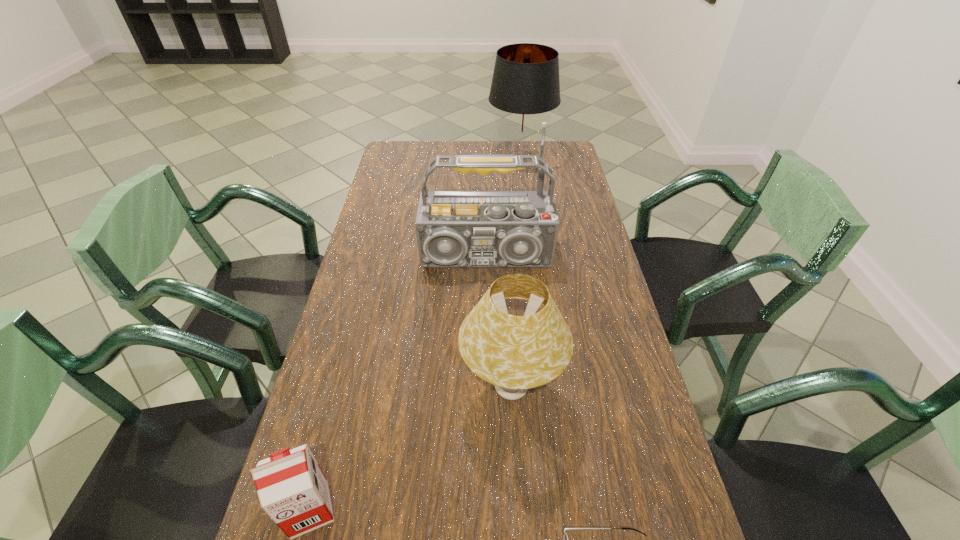
Where is `vacant region located on the back of the second shortest object`? Image resolution: width=960 pixels, height=540 pixels. vacant region located on the back of the second shortest object is located at coordinates (330, 430).

At what (x,y) coordinates should I click in order to perform the action: click on object positioned at the far edge. Please return your answer as a coordinate pair (x, y). The width and height of the screenshot is (960, 540). Looking at the image, I should click on (525, 86).

Where is `object located at the left edge`? object located at the left edge is located at coordinates (292, 489).

In order to click on object present at the right edge in this screenshot , I will do `click(525, 86)`.

The width and height of the screenshot is (960, 540). Find the location of `object at the far right corner`. object at the far right corner is located at coordinates (525, 86).

You are a GUI agent. You are given a task and a screenshot of the screen. Output one action in this format:
    pyautogui.click(x=<x>, y=<y>)
    Task: Click on the free region at the left edge of the desktop
    The image size is (960, 540).
    Given the screenshot: What is the action you would take?
    pyautogui.click(x=372, y=421)

I want to click on vacant area at the right edge of the desktop, so click(572, 205).

I want to click on vacant area at the far left corner, so click(408, 156).

Identify the location of free space at the far right corner. (547, 144).

The width and height of the screenshot is (960, 540). I want to click on vacant space in between the nearer lampshade and the fourth tallest object, so click(411, 449).